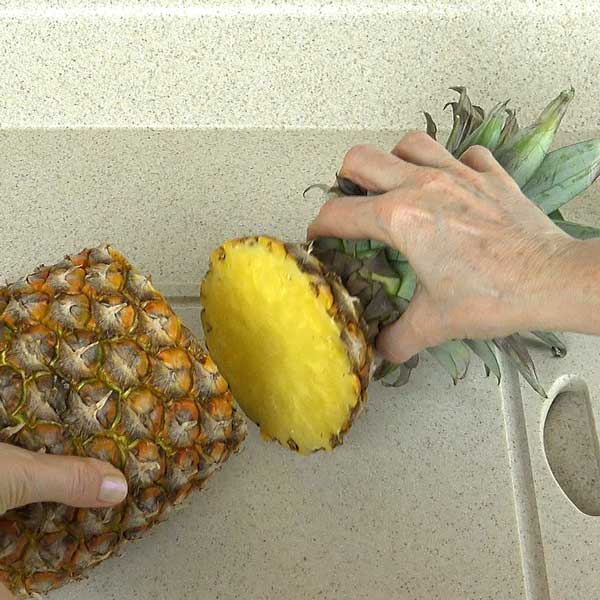
I want to click on groove in countertop, so click(x=526, y=530).